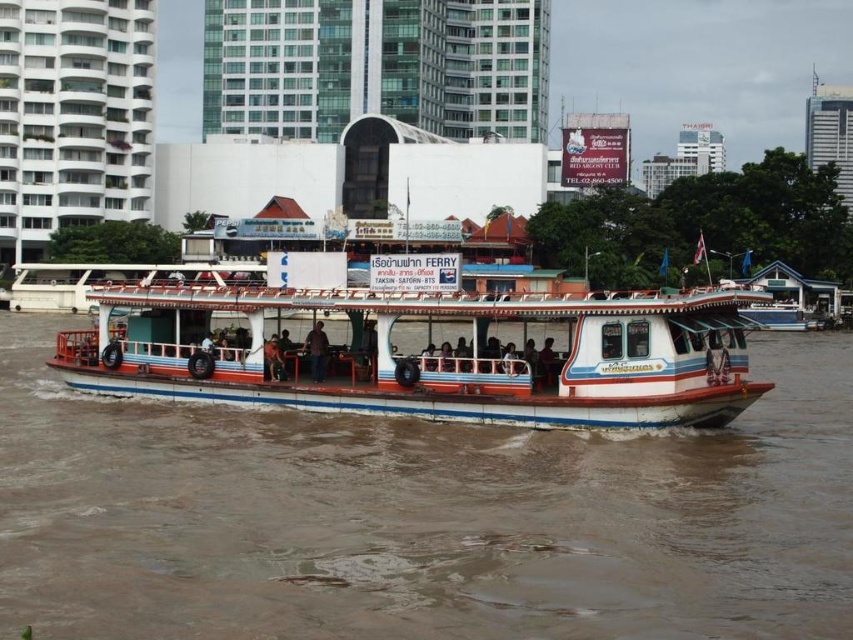
What are the coordinates of the brown muddy water at center in the image?

The brown muddy water at center is located at coordinates point (421,516).